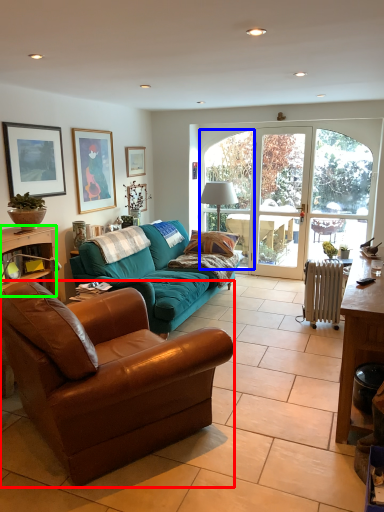
Question: Considering the real-world distances, which object is closest to studio couch (highlighted by a red box)? window (highlighted by a blue box) or desk (highlighted by a green box).

Choices:
 (A) window
 (B) desk

Answer: (B)